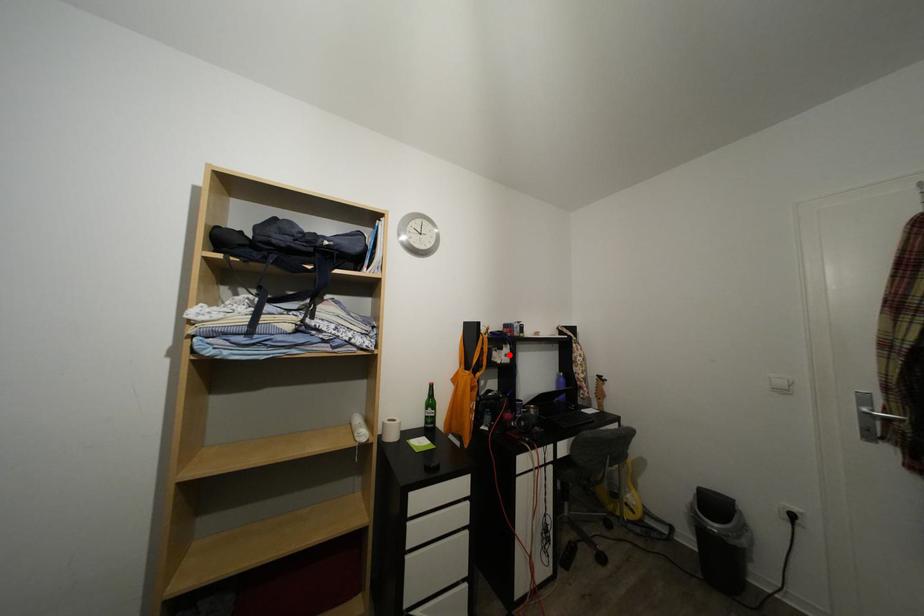
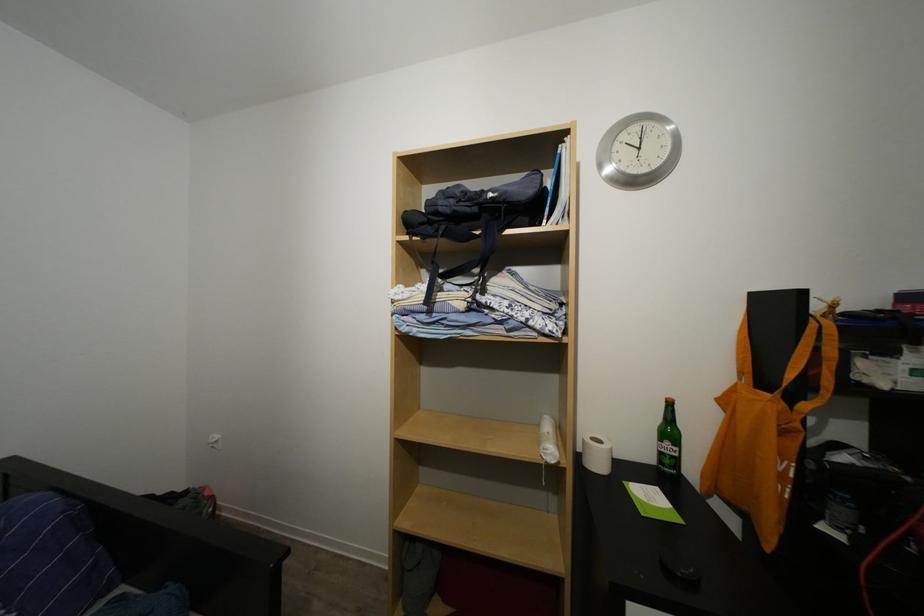
The point at the highlighted location is marked in the first image. Where is the corresponding point in the second image?

(900, 360)